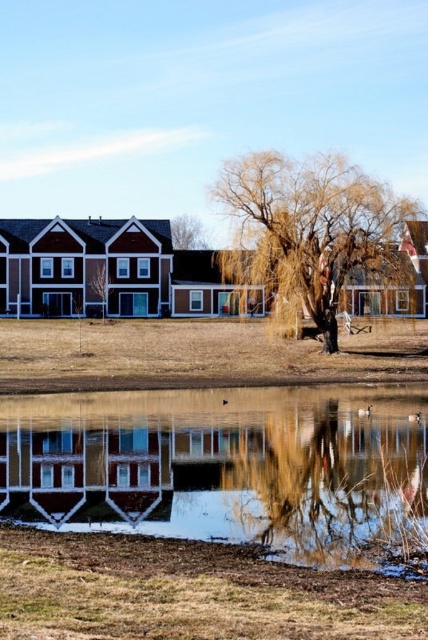
Question: Which object is farther from the camera taking this photo?

Choices:
 (A) brown textured tree at upper center
 (B) dry grass at center

Answer: (A)

Question: Can you confirm if reflective glass puddle at lower center is smaller than brown textured tree at upper center?

Choices:
 (A) yes
 (B) no

Answer: (A)

Question: Among these points, which one is nearest to the camera?

Choices:
 (A) (345, 513)
 (B) (180, 228)

Answer: (A)

Question: Does reflective glass puddle at lower center have a smaller size compared to brown textured tree at upper center?

Choices:
 (A) no
 (B) yes

Answer: (B)

Question: Is reflective glass puddle at lower center closer to the viewer compared to dry grass at center?

Choices:
 (A) no
 (B) yes

Answer: (B)

Question: Which point is closer to the camera?

Choices:
 (A) reflective glass puddle at lower center
 (B) brown textured tree at upper center
 (C) dry grass at center

Answer: (A)